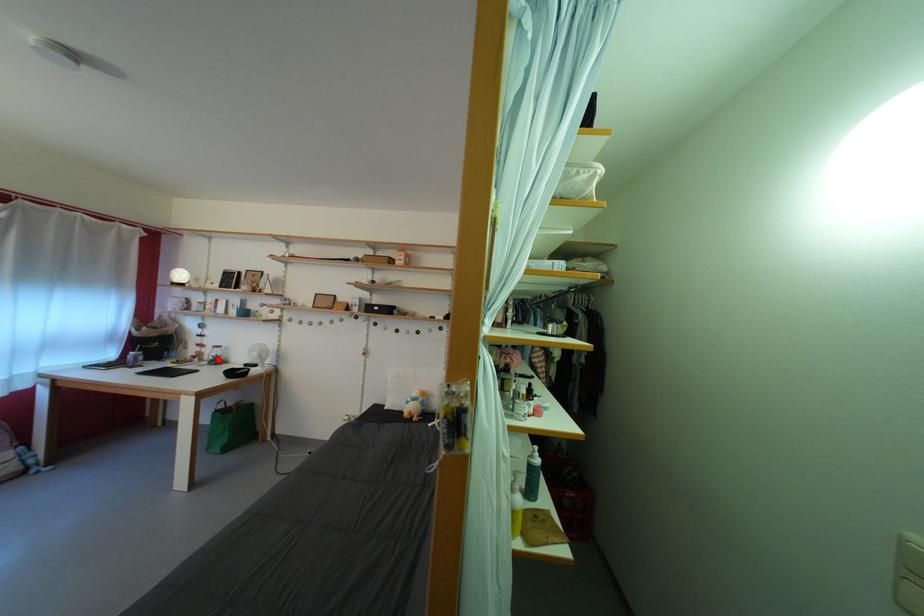
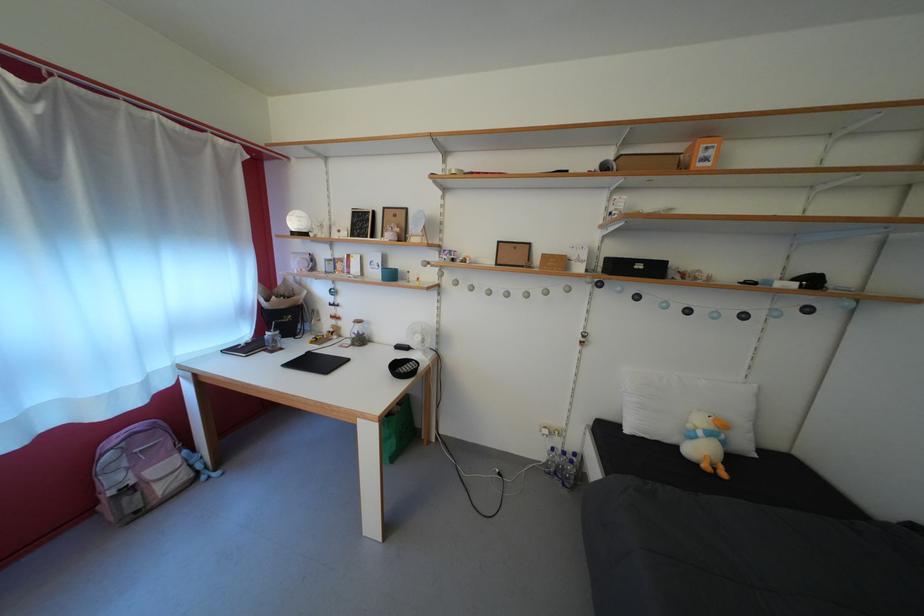
In the second image, find the point that corresponds to the highlighted location in the first image.

(358, 334)